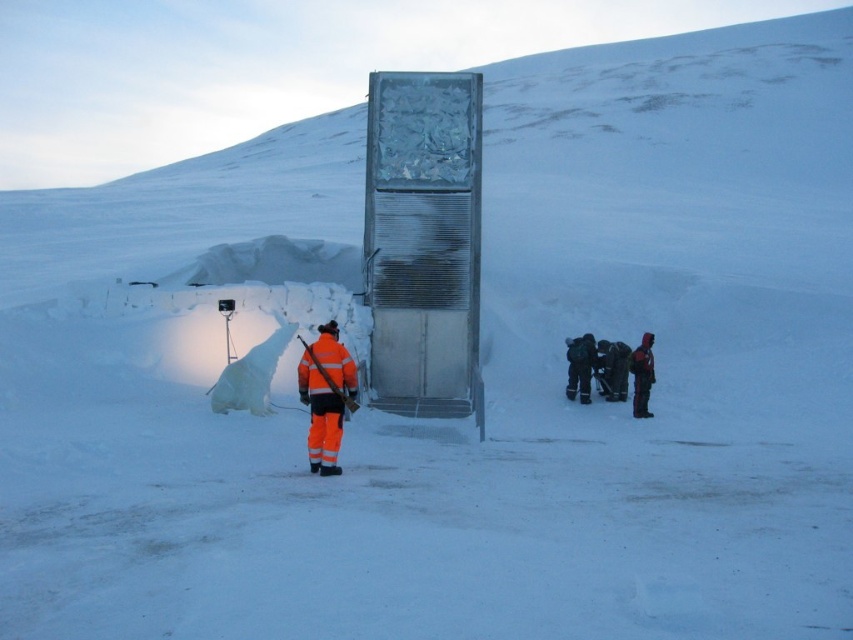
Is orange reflective safety vest at center further to camera compared to orange reflective jacket at lower right?

No, it is not.

Does orange reflective safety vest at center appear on the right side of orange reflective jacket at lower right?

In fact, orange reflective safety vest at center is to the left of orange reflective jacket at lower right.

Describe the element at coordinates (326, 368) in the screenshot. I see `orange reflective safety vest at center` at that location.

This screenshot has height=640, width=853. What are the coordinates of `orange reflective safety vest at center` in the screenshot? It's located at (326, 368).

Which is behind, point (334, 474) or point (641, 372)?

Point (641, 372)

What do you see at coordinates (326, 396) in the screenshot? I see `orange reflective jacket at center` at bounding box center [326, 396].

Where is `orange reflective jacket at center`? The image size is (853, 640). orange reflective jacket at center is located at coordinates (326, 396).

This screenshot has height=640, width=853. Identify the location of orange reflective jacket at center. (326, 396).

Is orange reflective jacket at center smaller than orange reflective safety vest at center?

Actually, orange reflective jacket at center might be larger than orange reflective safety vest at center.

Who is more forward, (350, 400) or (302, 353)?

Point (350, 400) is in front.

Identify the location of orange reflective jacket at center. Image resolution: width=853 pixels, height=640 pixels. (326, 396).